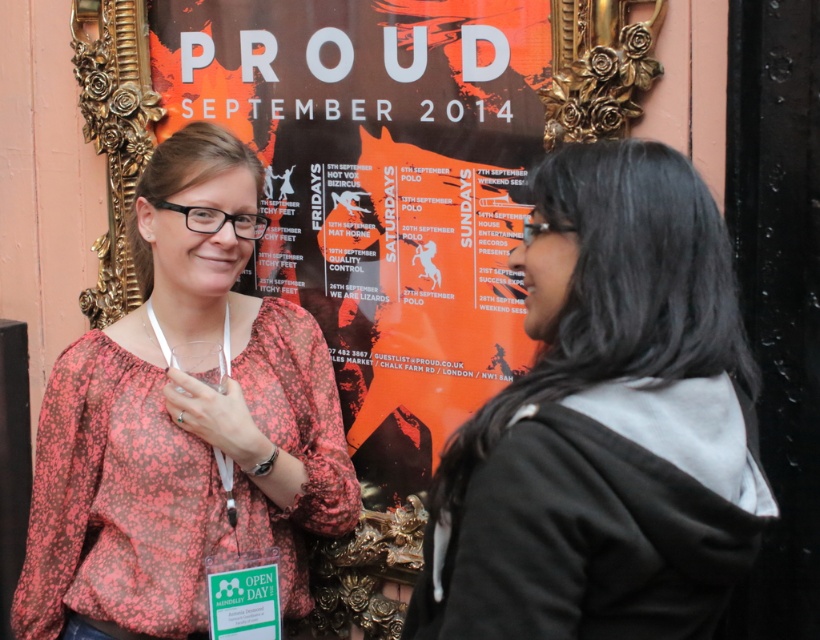
You are a photographer trying to capture the black fabric jacket at center in your shot. Based on the scene description, where should you focus your camera to ensure the jacket is centered in the frame?

To center the black fabric jacket at center in the frame, focus your camera at the coordinates point (x=598, y=426) as specified in the scene description.

You are standing in front of the promotional poster and notice two people in the image. According to the scene, which clothing item is closer to you between the black fabric jacket at center and the floral print blouse at center?

The black fabric jacket at center is closer to you because it is positioned in front of the floral print blouse at center.